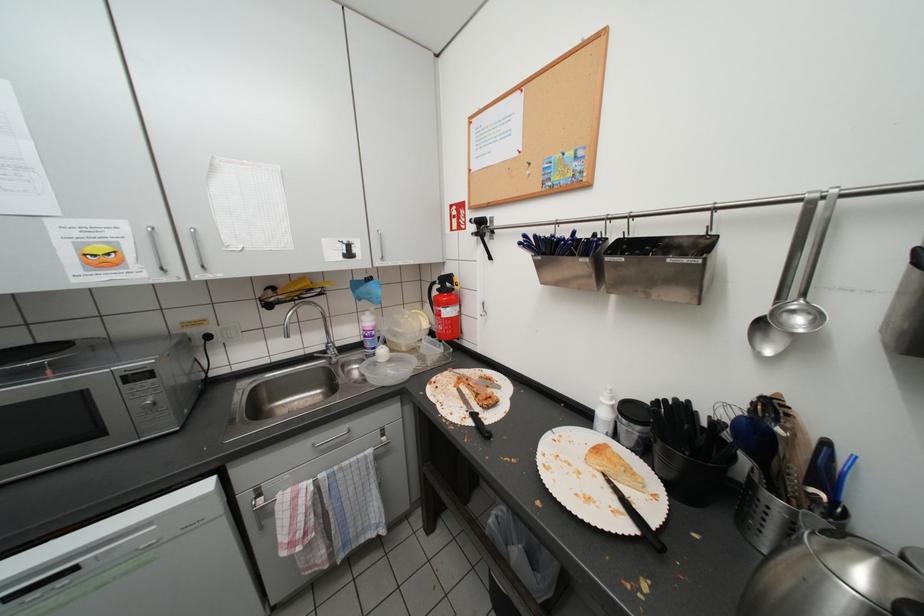
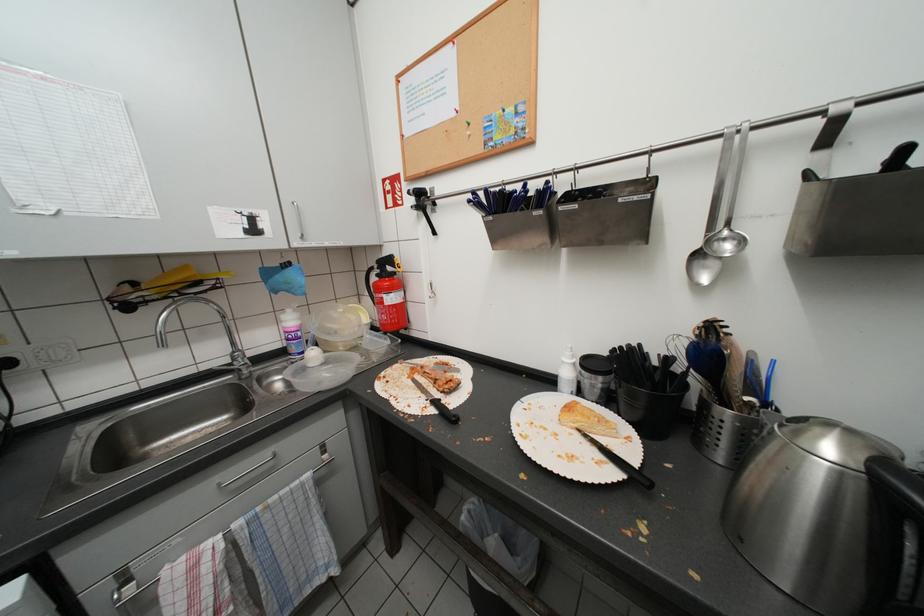
Question: The first image is from the beginning of the video and the second image is from the end. How did the camera likely rotate when shooting the video?

Choices:
 (A) Left
 (B) Right
 (C) Up
 (D) Down

Answer: (B)